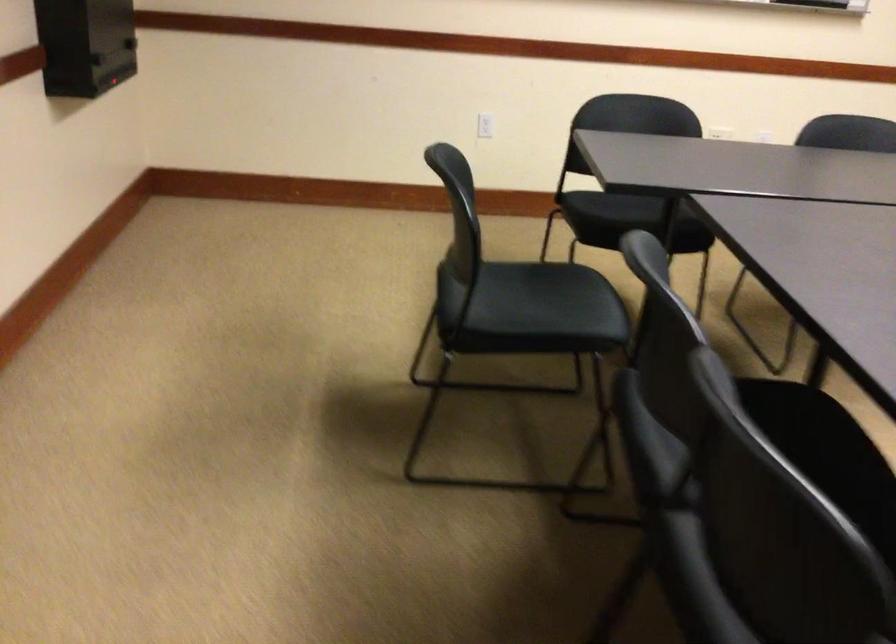
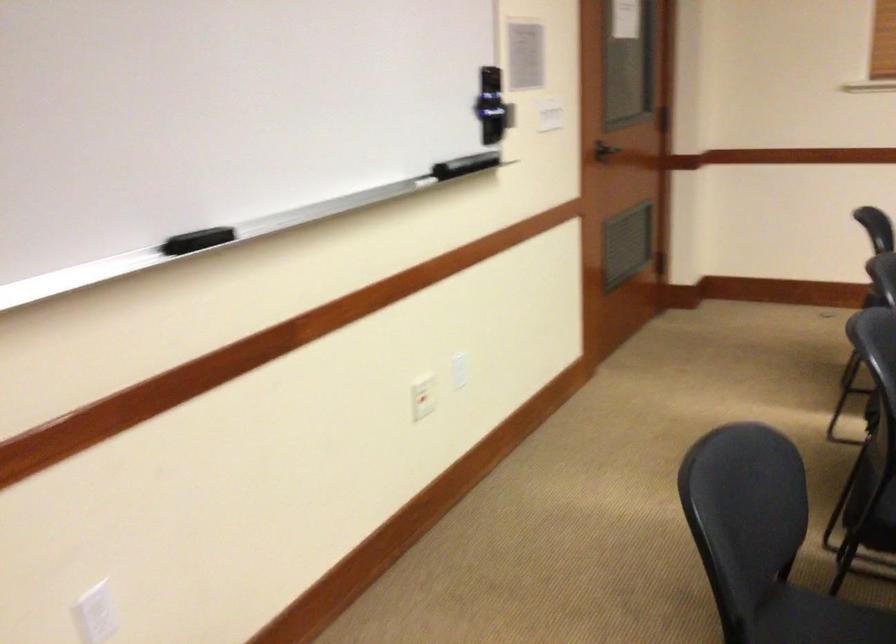
Question: The images are taken continuously from a first-person perspective. In which direction are you moving?

Choices:
 (A) Left
 (B) Right
 (C) Forward
 (D) Backward

Answer: (D)